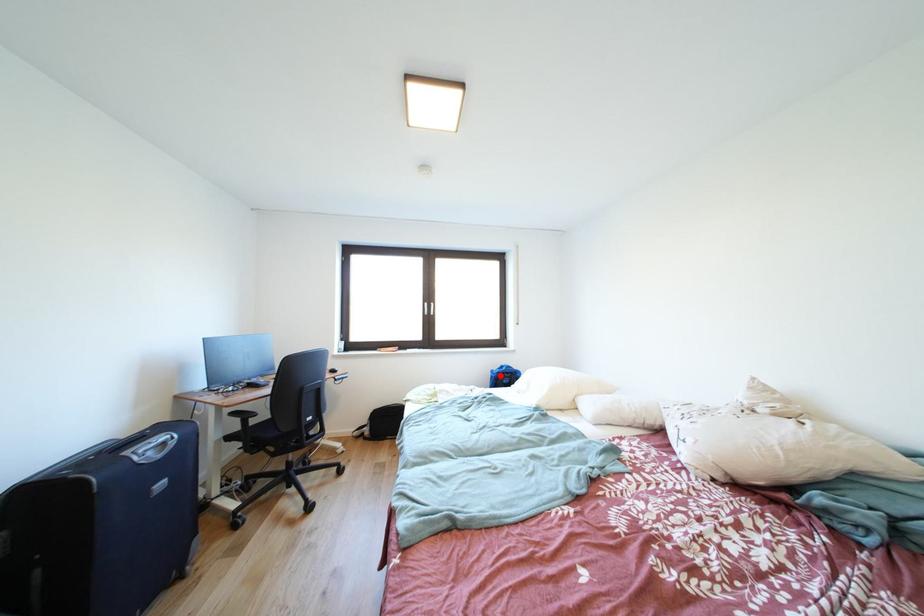
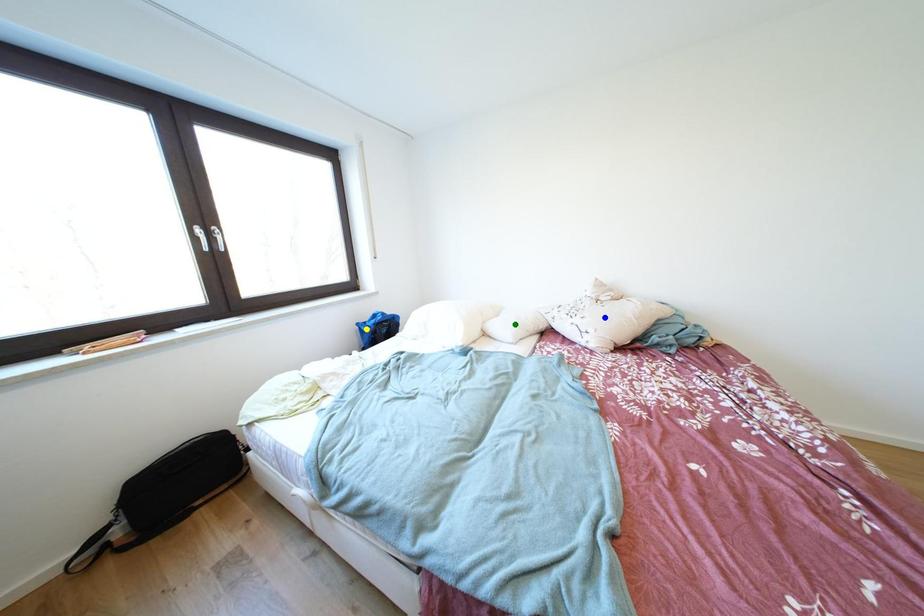
Question: I am providing you with two images of the same scene from different viewpoints. A red point is marked on the first image. You are given multiple points on the second image. Which point in image 2 is actually the same real-world point as the red point in image 1?

Choices:
 (A) yellow point
 (B) blue point
 (C) green point

Answer: (A)